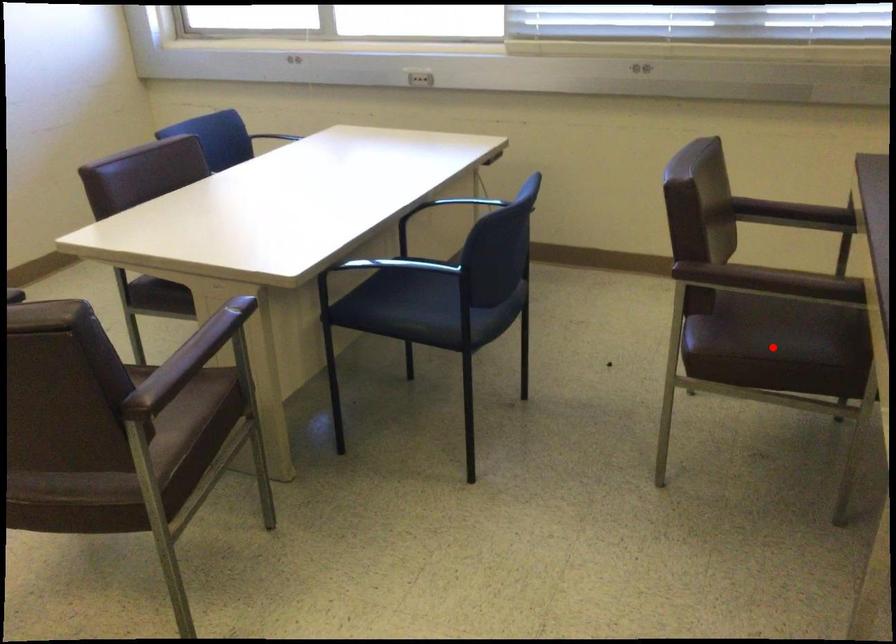
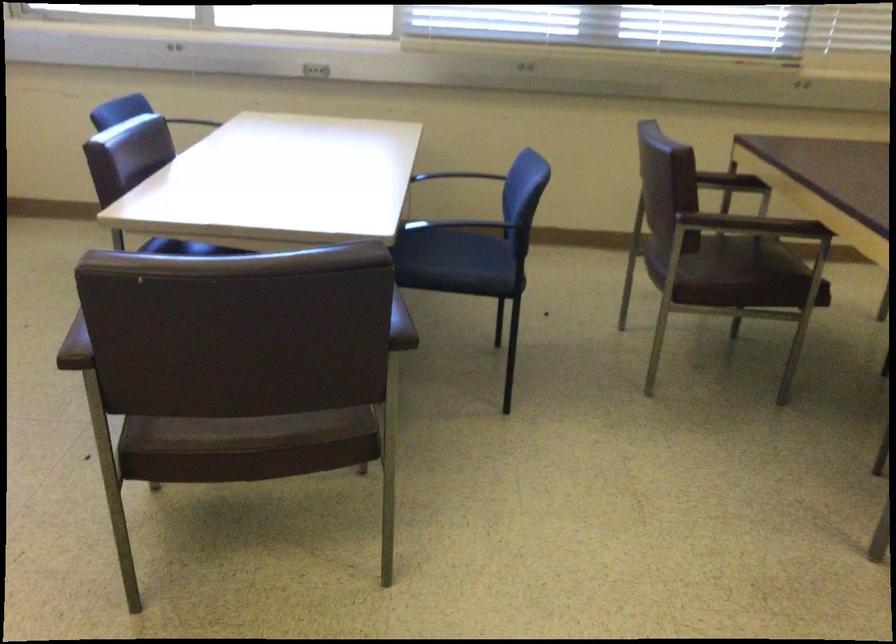
Question: I am providing you with two images of the same scene from different viewpoints. Image1 has a red point marked. In image2, the corresponding 3D location appears at what relative position? Reply with the corresponding letter.

Choices:
 (A) Closer
 (B) Farther

Answer: (B)